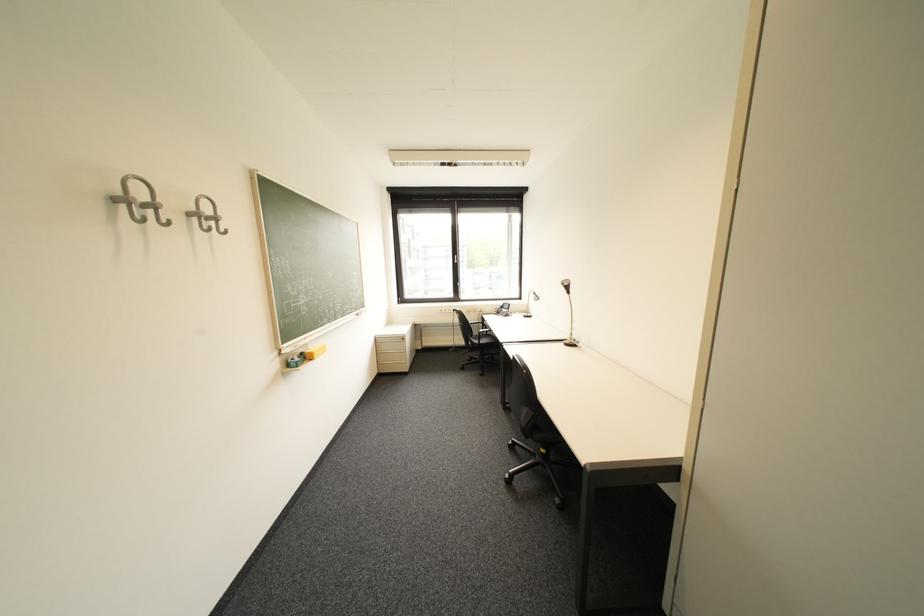
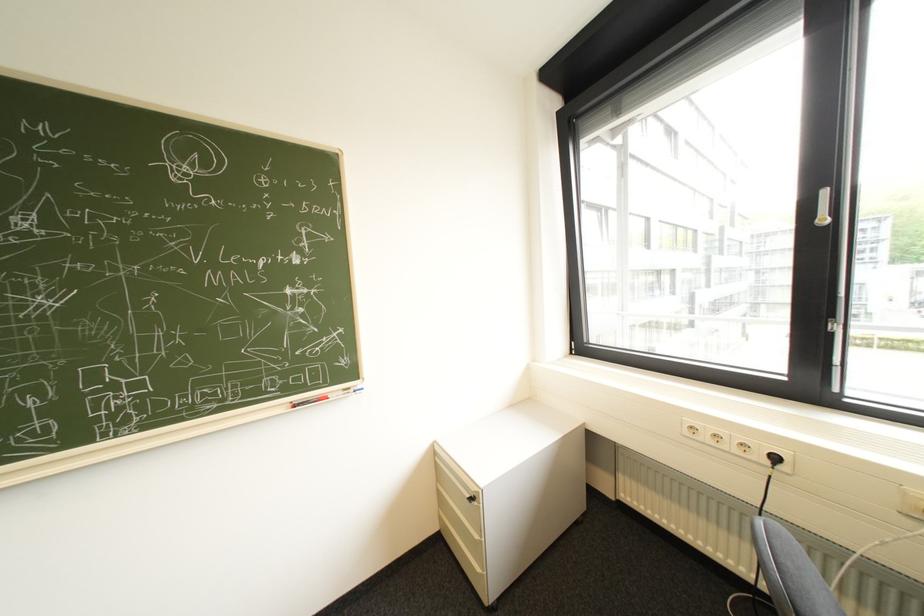
The point at [466,257] is marked in the first image. Where is the corresponding point in the second image?

(834, 193)